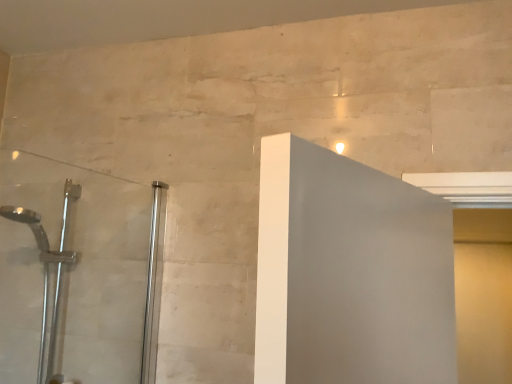
Question: Is matte yellow screen door at right far away from silver metallic shower head at left?

Choices:
 (A) no
 (B) yes

Answer: (B)

Question: Is matte yellow screen door at right with silver metallic shower head at left?

Choices:
 (A) yes
 (B) no

Answer: (B)

Question: From the image's perspective, is matte yellow screen door at right under silver metallic shower head at left?

Choices:
 (A) no
 (B) yes

Answer: (B)

Question: From a real-world perspective, is matte yellow screen door at right over silver metallic shower head at left?

Choices:
 (A) no
 (B) yes

Answer: (A)

Question: Can you confirm if matte yellow screen door at right is wider than silver metallic shower head at left?

Choices:
 (A) no
 (B) yes

Answer: (A)

Question: Is matte yellow screen door at right positioned beyond the bounds of silver metallic shower head at left?

Choices:
 (A) no
 (B) yes

Answer: (B)

Question: From a real-world perspective, is silver metallic shower head at left physically above clear glass shower door at left?

Choices:
 (A) yes
 (B) no

Answer: (B)

Question: Can you confirm if silver metallic shower head at left is wider than clear glass shower door at left?

Choices:
 (A) yes
 (B) no

Answer: (A)

Question: Does silver metallic shower head at left have a larger size compared to clear glass shower door at left?

Choices:
 (A) yes
 (B) no

Answer: (A)

Question: Does silver metallic shower head at left have a smaller size compared to clear glass shower door at left?

Choices:
 (A) yes
 (B) no

Answer: (B)

Question: Is silver metallic shower head at left looking in the opposite direction of clear glass shower door at left?

Choices:
 (A) no
 (B) yes

Answer: (A)

Question: Could you tell me if silver metallic shower head at left is facing clear glass shower door at left?

Choices:
 (A) no
 (B) yes

Answer: (A)

Question: Is matte yellow screen door at right smaller than clear glass shower door at left?

Choices:
 (A) yes
 (B) no

Answer: (B)